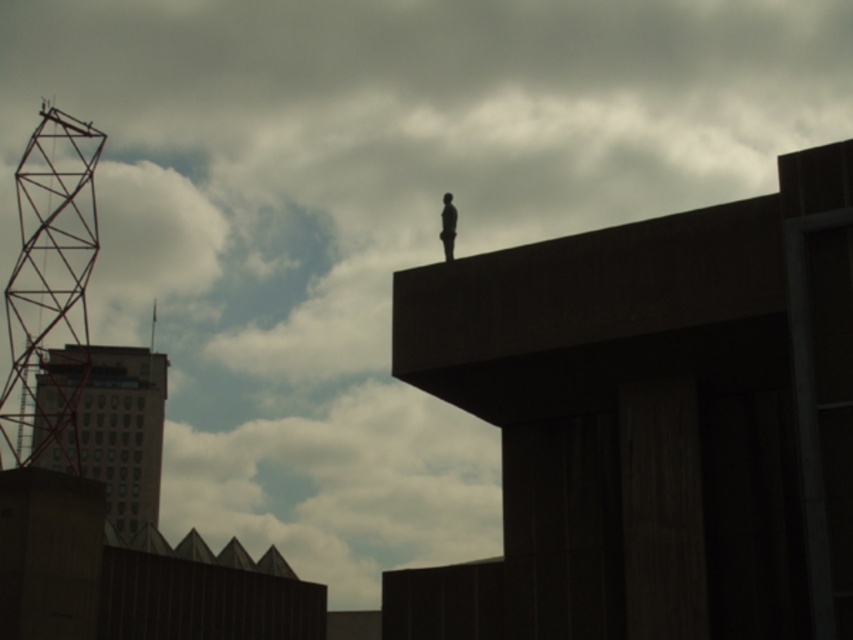
Question: Does gray concrete building at left appear over silhouette figure at upper center?

Choices:
 (A) yes
 (B) no

Answer: (B)

Question: Is gray concrete building at left wider than silhouette figure at upper center?

Choices:
 (A) yes
 (B) no

Answer: (A)

Question: Which of the following is the closest to the observer?

Choices:
 (A) silhouette figure at upper center
 (B) gray concrete building at left

Answer: (A)

Question: Is gray concrete building at left bigger than silhouette figure at upper center?

Choices:
 (A) no
 (B) yes

Answer: (B)